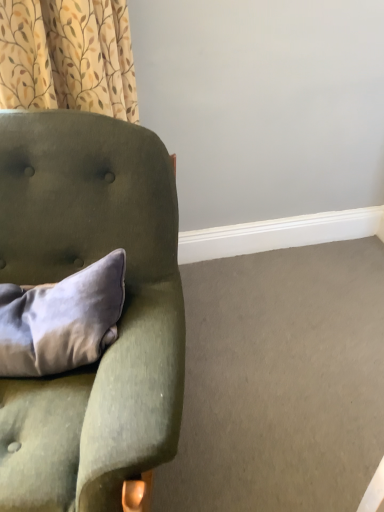
Question: Is velvet green armchair at left smaller than satin gray pillow at left?

Choices:
 (A) yes
 (B) no

Answer: (B)

Question: Would you say velvet green armchair at left is a long distance from satin gray pillow at left?

Choices:
 (A) no
 (B) yes

Answer: (A)

Question: From the image's perspective, does velvet green armchair at left appear higher than satin gray pillow at left?

Choices:
 (A) yes
 (B) no

Answer: (B)

Question: From a real-world perspective, is velvet green armchair at left beneath satin gray pillow at left?

Choices:
 (A) yes
 (B) no

Answer: (A)

Question: From the image's perspective, is velvet green armchair at left located beneath satin gray pillow at left?

Choices:
 (A) no
 (B) yes

Answer: (B)

Question: From a real-world perspective, is satin gray pillow at left above or below velvet green armchair at left?

Choices:
 (A) above
 (B) below

Answer: (A)

Question: In terms of height, does satin gray pillow at left look taller or shorter compared to velvet green armchair at left?

Choices:
 (A) short
 (B) tall

Answer: (A)

Question: In terms of size, does satin gray pillow at left appear bigger or smaller than velvet green armchair at left?

Choices:
 (A) big
 (B) small

Answer: (B)

Question: Which is correct: satin gray pillow at left is inside velvet green armchair at left, or outside of it?

Choices:
 (A) outside
 (B) inside

Answer: (B)

Question: From a real-world perspective, relative to patterned fabric curtain at upper left, is satin gray pillow at left vertically above or below?

Choices:
 (A) above
 (B) below

Answer: (B)

Question: Considering the positions of satin gray pillow at left and patterned fabric curtain at upper left in the image, is satin gray pillow at left wider or thinner than patterned fabric curtain at upper left?

Choices:
 (A) wide
 (B) thin

Answer: (B)

Question: Considering their positions, is satin gray pillow at left located in front of or behind patterned fabric curtain at upper left?

Choices:
 (A) behind
 (B) front

Answer: (B)

Question: Based on their sizes in the image, would you say satin gray pillow at left is bigger or smaller than patterned fabric curtain at upper left?

Choices:
 (A) small
 (B) big

Answer: (A)

Question: Considering the positions of point pos(142,285) and point pos(77,94), is point pos(142,285) closer or farther from the camera than point pos(77,94)?

Choices:
 (A) farther
 (B) closer

Answer: (B)

Question: Is velvet green armchair at left in front of or behind patterned fabric curtain at upper left in the image?

Choices:
 (A) front
 (B) behind

Answer: (A)